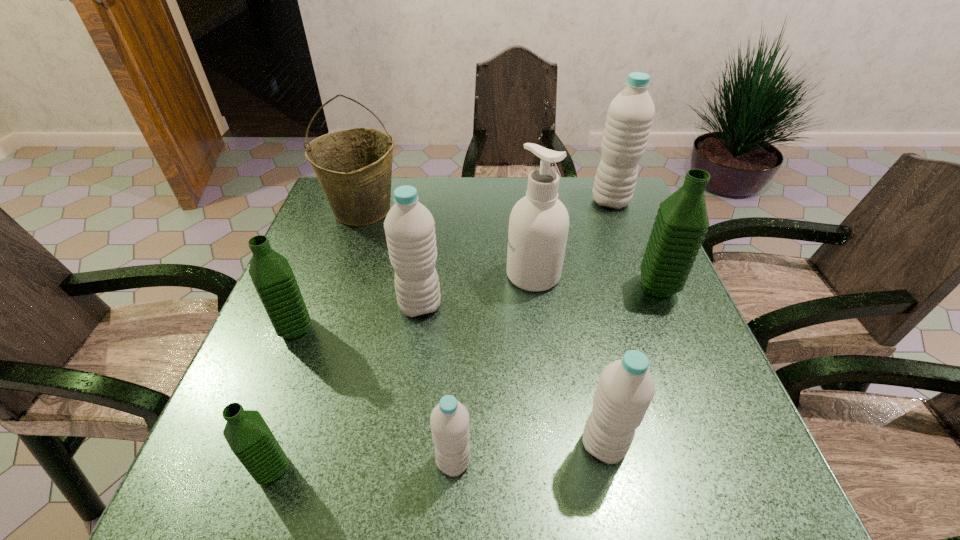
The height and width of the screenshot is (540, 960). Find the location of `green water bottle identified as the closest to the farthest water bottle`. green water bottle identified as the closest to the farthest water bottle is located at coordinates (681, 223).

Point out which green water bottle is positioned as the nearest to the second nearest green water bottle. Please provide its 2D coordinates. Your answer should be formatted as a tuple, i.e. [(x, y)], where the tuple contains the x and y coordinates of a point satisfying the conditions above.

[(249, 437)]

The height and width of the screenshot is (540, 960). What are the coordinates of `vacant region that satisfies the following two spatial constraints: 1. on the front label of the cleansing agent; 2. on the back side of the second white water bottle from right to left` in the screenshot? It's located at (555, 445).

Locate an element on the screen. vacant area that satisfies the following two spatial constraints: 1. on the front label of the fifth water bottle from left to right; 2. on the left side of the cleansing agent is located at coordinates (555, 445).

The image size is (960, 540). Identify the location of vacant space that satisfies the following two spatial constraints: 1. on the front side of the fourth object from left to right; 2. on the left side of the smallest white water bottle. (398, 461).

Find the location of `vacant position in the image that satisfies the following two spatial constraints: 1. on the front label of the biggest green water bottle; 2. on the left side of the cleansing agent`. vacant position in the image that satisfies the following two spatial constraints: 1. on the front label of the biggest green water bottle; 2. on the left side of the cleansing agent is located at coordinates (535, 287).

This screenshot has height=540, width=960. What are the coordinates of `blank space that satisfies the following two spatial constraints: 1. on the front label of the cleansing agent; 2. on the front side of the third nearest white water bottle` in the screenshot? It's located at (538, 306).